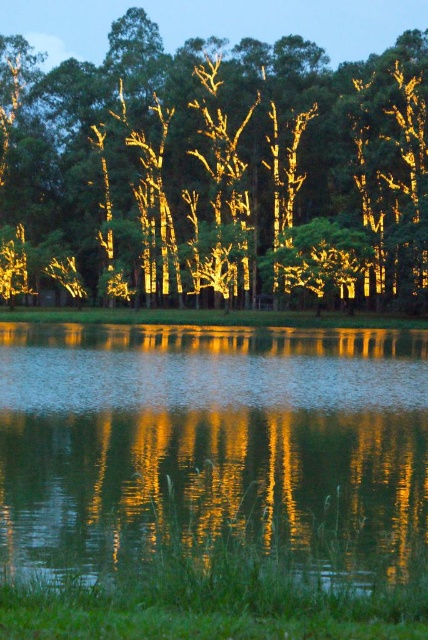
Is illuminated bark tree at center thinner than glistening reflective water at bottom?

No.

Is point (139, 90) positioned after point (109, 413)?

Yes, it is.

Which is behind, point (258, 148) or point (222, 408)?

Point (258, 148)

You are a GUI agent. You are given a task and a screenshot of the screen. Output one action in this format:
    pyautogui.click(x=<x>, y=<y>)
    Task: Click on the illuminated bark tree at center
    
    Given the screenshot: What is the action you would take?
    pos(219,170)